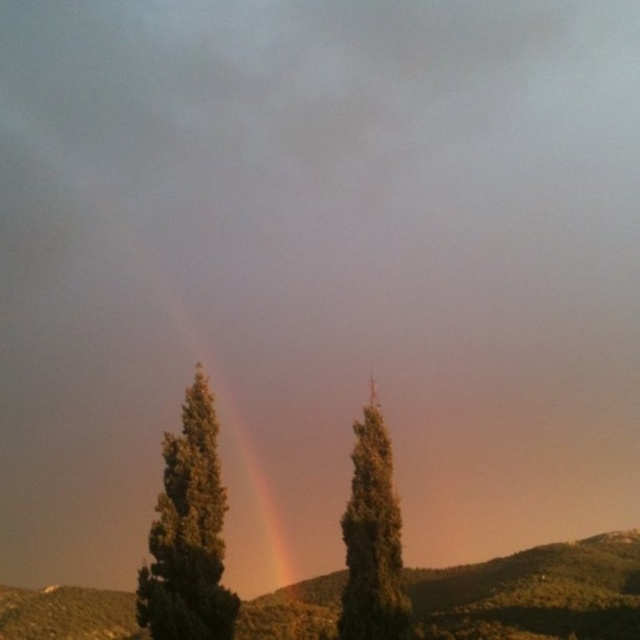
Question: Which point appears closest to the camera in this image?

Choices:
 (A) (179, 435)
 (B) (253, 477)
 (C) (365, 628)

Answer: (C)

Question: Which object is positioned closest to the green textured hill at lower center?

Choices:
 (A) green matte tree at center
 (B) green textured tree at center

Answer: (B)

Question: Is green textured hill at lower center smaller than green textured tree at center?

Choices:
 (A) yes
 (B) no

Answer: (B)

Question: Does green matte tree at center lie in front of rainbow at center?

Choices:
 (A) no
 (B) yes

Answer: (B)

Question: Is green textured hill at lower center wider than green matte tree at center?

Choices:
 (A) yes
 (B) no

Answer: (A)

Question: Which point is farther to the camera?

Choices:
 (A) green matte tree at center
 (B) rainbow at center
 (C) green textured tree at center
 (D) green textured hill at lower center

Answer: (B)